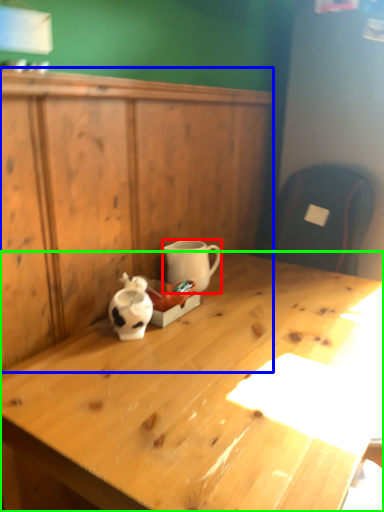
Question: Which object is positioned closest to coffee cup (highlighted by a red box)? Select from dresser (highlighted by a blue box) and desk (highlighted by a green box).

Choices:
 (A) dresser
 (B) desk

Answer: (A)